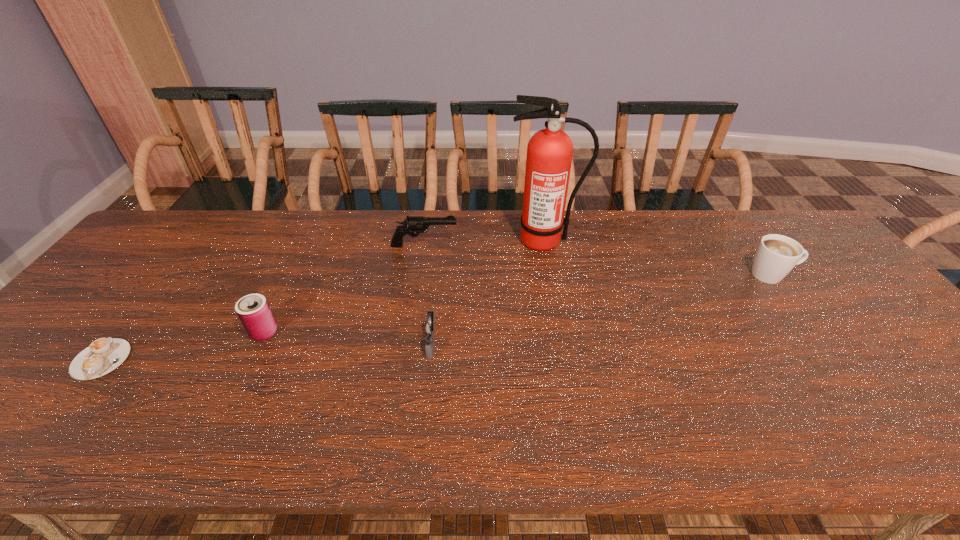
The width and height of the screenshot is (960, 540). Identify the location of the fifth object from left to right. (549, 152).

What are the coordinates of `fire extinguisher` in the screenshot? It's located at (549, 152).

Identify the location of gun. (412, 224).

Find the location of a particular element. This screenshot has height=540, width=960. the taller cappuccino is located at coordinates (776, 255).

Find the location of a particular element. This screenshot has width=960, height=540. the fourth nearest object is located at coordinates pos(776,255).

At what (x,y) coordinates should I click in order to perform the action: click on igniter. Please return your answer as a coordinate pair (x, y). Looking at the image, I should click on (429, 329).

Identify the location of the fifth object from right to left. (253, 310).

Image resolution: width=960 pixels, height=540 pixels. Identify the location of the nearer cappuccino. (103, 355).

The image size is (960, 540). What are the coordinates of `the leftmost object` in the screenshot? It's located at (103, 355).

At what (x,y) coordinates should I click in order to perform the action: click on vacant space located on the handle side of the fire extinguisher. Please return your answer as a coordinate pair (x, y). Looking at the image, I should click on (556, 306).